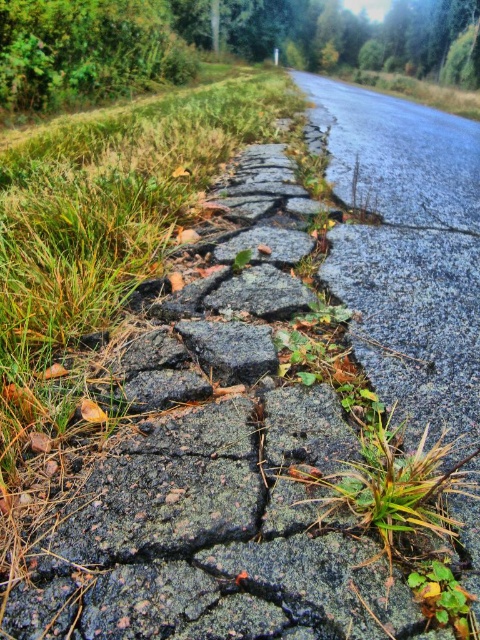
Between point (248, 339) and point (259, 292), which one is positioned behind?

Point (259, 292)

Which is in front, point (250, 339) or point (269, 310)?

Point (250, 339)

Does point (197, 358) come in front of point (238, 300)?

Yes.

Where is `black rough stone at center`? This screenshot has width=480, height=640. black rough stone at center is located at coordinates (229, 348).

Is point (357, 448) behind point (229, 336)?

No.

Is green grass at center wider than black rough stone at center?

Yes.

Image resolution: width=480 pixels, height=640 pixels. Describe the element at coordinates (360, 468) in the screenshot. I see `green grass at center` at that location.

The image size is (480, 640). Identify the location of green grass at center. (360, 468).

Between green grass at center and dark gray rough stone at center, which one is positioned higher?

dark gray rough stone at center is above.

Does green grass at center have a greater height compared to dark gray rough stone at center?

Yes, green grass at center is taller than dark gray rough stone at center.

Between point (357, 508) and point (275, 278), which one is positioned in front?

Positioned in front is point (357, 508).

Identify the location of green grass at center. (360, 468).